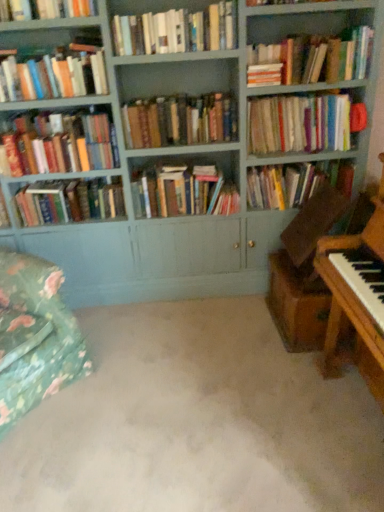
Identify the location of hardcover books at upper left, the tenth book positioned from the right. (x=54, y=74).

Where is `hardcover books at left, which is the 8th book in right-to-left order`? The width and height of the screenshot is (384, 512). hardcover books at left, which is the 8th book in right-to-left order is located at coordinates (60, 144).

This screenshot has width=384, height=512. Describe the element at coordinates (176, 31) in the screenshot. I see `hardcover books at upper center, marked as the 6th book in a right-to-left arrangement` at that location.

Describe the element at coordinates (183, 159) in the screenshot. The width and height of the screenshot is (384, 512). I see `wooden bookcase at upper center` at that location.

The image size is (384, 512). I want to click on carpet at center, so click(197, 421).

How many degrees apart are the facing directions of hardcover books at upper center, marked as the 6th book in a right-to-left arrangement, and hardcover books at upper left, the tenth book positioned from the right?

2.7 degrees.

Based on the photo, is hardcover books at upper center, marked as the 6th book in a right-to-left arrangement, taller or shorter than hardcover books at upper left, the tenth book positioned from the right?

Clearly, hardcover books at upper center, marked as the 6th book in a right-to-left arrangement, is shorter compared to hardcover books at upper left, the tenth book positioned from the right.

Between hardcover books at upper center, marked as the 6th book in a right-to-left arrangement, and hardcover books at upper left, arranged as the first book when viewed from the left, which one appears on the left side from the viewer's perspective?

From the viewer's perspective, hardcover books at upper left, arranged as the first book when viewed from the left, appears more on the left side.

Which point is more distant from viewer, [223,27] or [53,87]?

The point [53,87] is behind.

Is hardcover books at upper right, marked as the eighth book in a left-to-right arrangement, facing towards hardcover books at left, the third book viewed from the left?

No.

Considering the positions of objects hardcover books at upper right, marked as the eighth book in a left-to-right arrangement, and hardcover books at left, the third book viewed from the left, in the image provided, who is in front, hardcover books at upper right, marked as the eighth book in a left-to-right arrangement, or hardcover books at left, the third book viewed from the left,?

hardcover books at left, the third book viewed from the left, is in front.

Which is correct: hardcover books at upper right, marked as the eighth book in a left-to-right arrangement, is inside hardcover books at left, which is the 8th book in right-to-left order, or outside of it?

hardcover books at upper right, marked as the eighth book in a left-to-right arrangement, lies outside hardcover books at left, which is the 8th book in right-to-left order.

From a real-world perspective, is matte hardcover book at left, the 7th book positioned from the right, physically above hardcover book at upper left, arranged as the 2th book when viewed from the left?

No.

Which object is further away from the camera, matte hardcover book at left, the 7th book positioned from the right, or hardcover book at upper left, arranged as the 2th book when viewed from the left?

matte hardcover book at left, the 7th book positioned from the right, is further from the camera.

Consider the image. Does matte hardcover book at left, the 4th book positioned from the left, appear on the left side of hardcover book at upper left, arranged as the 2th book when viewed from the left?

In fact, matte hardcover book at left, the 4th book positioned from the left, is to the right of hardcover book at upper left, arranged as the 2th book when viewed from the left.

Is matte hardcover book at left, the 7th book positioned from the right, looking in the opposite direction of hardcover book at upper left, arranged as the 2th book when viewed from the left?

No, matte hardcover book at left, the 7th book positioned from the right, is not facing away from hardcover book at upper left, arranged as the 2th book when viewed from the left.

Is wooden bookcase at upper center located within hardcover book at upper left, arranged as the 2th book when viewed from the left?

No, wooden bookcase at upper center is not a part of hardcover book at upper left, arranged as the 2th book when viewed from the left.

Between hardcover book at upper left, arranged as the 2th book when viewed from the left, and wooden bookcase at upper center, which one has larger size?

wooden bookcase at upper center.

Considering the sizes of hardcover book at upper left, acting as the 9th book starting from the right, and wooden bookcase at upper center in the image, is hardcover book at upper left, acting as the 9th book starting from the right, taller or shorter than wooden bookcase at upper center?

Considering their sizes, hardcover book at upper left, acting as the 9th book starting from the right, has less height than wooden bookcase at upper center.

Considering the positions of objects hardcover book at upper left, arranged as the 2th book when viewed from the left, and wooden bookcase at upper center in the image provided, who is behind, hardcover book at upper left, arranged as the 2th book when viewed from the left, or wooden bookcase at upper center?

hardcover book at upper left, arranged as the 2th book when viewed from the left, is further away from the camera.

From a real-world perspective, is hardcover books at upper right, which is the ninth book from left to right, physically located above or below hardcover books at left, which is the 8th book in right-to-left order?

hardcover books at upper right, which is the ninth book from left to right, is situated higher than hardcover books at left, which is the 8th book in right-to-left order, in the real world.

Does hardcover books at upper right, which is the second book from right to left, appear on the left side of hardcover books at left, which is the 8th book in right-to-left order?

Incorrect, hardcover books at upper right, which is the second book from right to left, is not on the left side of hardcover books at left, which is the 8th book in right-to-left order.

Is hardcover books at upper right, which is the ninth book from left to right, facing towards hardcover books at left, which is the 8th book in right-to-left order?

No, hardcover books at upper right, which is the ninth book from left to right, is not oriented towards hardcover books at left, which is the 8th book in right-to-left order.

From the picture: Between hardcover books at upper right, which is the ninth book from left to right, and hardcover books at left, which is the 8th book in right-to-left order, which one has larger size?

hardcover books at upper right, which is the ninth book from left to right, is bigger.

Does point (261, 112) come in front of point (170, 106)?

No, it is not.

Can you confirm if hardcover books at upper right, marked as the eighth book in a left-to-right arrangement, is positioned to the right of hardcover books at center, positioned as the fifth book in right-to-left order?

Correct, you'll find hardcover books at upper right, marked as the eighth book in a left-to-right arrangement, to the right of hardcover books at center, positioned as the fifth book in right-to-left order.

Measure the distance from hardcover books at upper right, the 3th book viewed from the right, to hardcover books at center, the 6th book when ordered from left to right.

hardcover books at upper right, the 3th book viewed from the right, is 15.62 inches from hardcover books at center, the 6th book when ordered from left to right.

Where is `book that is the 8th object located behind the green floral fabric swivel chair at lower left`? Image resolution: width=384 pixels, height=512 pixels. book that is the 8th object located behind the green floral fabric swivel chair at lower left is located at coordinates (183, 192).

Can you confirm if green floral fabric swivel chair at lower left is positioned to the left of hardcover books at center, the fourth book when ordered from right to left?

Correct, you'll find green floral fabric swivel chair at lower left to the left of hardcover books at center, the fourth book when ordered from right to left.

In terms of size, does green floral fabric swivel chair at lower left appear bigger or smaller than hardcover books at center, the fourth book when ordered from right to left?

green floral fabric swivel chair at lower left is bigger than hardcover books at center, the fourth book when ordered from right to left.

The width and height of the screenshot is (384, 512). Identify the location of the 4th book counting from the left of the hardcover books at upper center, marked as the 6th book in a right-to-left arrangement. (x=54, y=74).

At what (x,y) coordinates should I click in order to perform the action: click on the 5th book to the right of the hardcover books at left, the third book viewed from the left, counting from the anchor's position. Please return your answer as a coordinate pair (x, y). This screenshot has height=512, width=384. Looking at the image, I should click on (300, 124).

When comparing their distances from hardcover books at upper right, which is the second book from right to left, does hardcover books at center, the fourth book when ordered from right to left, or hardcover book at center, which is the 1th book from right to left, seem further?

hardcover books at center, the fourth book when ordered from right to left, is positioned further to the anchor hardcover books at upper right, which is the second book from right to left.

Looking at the image, which one is located further to wooden bookcase at upper center, hardcover books at upper right, which is the ninth book from left to right, or wooden piano at right?

wooden piano at right.

Based on their spatial positions, is hardcover books at upper center, marked as the 6th book in a right-to-left arrangement, or wooden bookcase at upper center further from hardcover book at upper left, arranged as the 2th book when viewed from the left?

wooden bookcase at upper center is further to hardcover book at upper left, arranged as the 2th book when viewed from the left.

Which object lies nearer to the anchor point matte hardcover book at left, the 4th book positioned from the left, hardcover books at upper center, marked as the 6th book in a right-to-left arrangement, or wooden bookcase at upper center?

wooden bookcase at upper center is positioned closer to the anchor matte hardcover book at left, the 4th book positioned from the left.

From the image, which object appears to be nearer to hardcover books at upper center, arranged as the fifth book when viewed from the left, hardcover books at upper right, which is the ninth book from left to right, or hardcover books at upper right, marked as the eighth book in a left-to-right arrangement?

Based on the image, hardcover books at upper right, which is the ninth book from left to right, appears to be nearer to hardcover books at upper center, arranged as the fifth book when viewed from the left.

From the picture: When comparing their distances from hardcover books at upper left, the tenth book positioned from the right, does hardcover books at center, the 7th book when ordered from left to right, or hardcover books at upper right, the 3th book viewed from the right, seem further?

Based on the image, hardcover books at upper right, the 3th book viewed from the right, appears to be further to hardcover books at upper left, the tenth book positioned from the right.

Looking at the image, which one is located further to matte hardcover book at left, the 4th book positioned from the left, hardcover books at upper right, which is the second book from right to left, or hardcover books at center, the fourth book when ordered from right to left?

Based on the image, hardcover books at upper right, which is the second book from right to left, appears to be further to matte hardcover book at left, the 4th book positioned from the left.

Estimate the real-world distances between objects in this image. Which object is closer to hardcover books at upper right, marked as the eighth book in a left-to-right arrangement, hardcover books at upper left, arranged as the first book when viewed from the left, or wooden bookcase at upper center?

Among the two, wooden bookcase at upper center is located nearer to hardcover books at upper right, marked as the eighth book in a left-to-right arrangement.

Locate an element on the screen. This screenshot has height=512, width=384. bookcase located between matte hardcover book at left, the 7th book positioned from the right, and hardcover books at upper right, which is the ninth book from left to right, in the left-right direction is located at coordinates (183, 159).

You are a GUI agent. You are given a task and a screenshot of the screen. Output one action in this format:
    pyautogui.click(x=<x>, y=<y>)
    Task: Click on the plain between wooden piano at right and matte hardcover book at left, the 7th book positioned from the right, from front to back
    This screenshot has height=512, width=384.
    Given the screenshot: What is the action you would take?
    pyautogui.click(x=197, y=421)

Locate an element on the screen. bookcase between hardcover books at upper left, arranged as the first book when viewed from the left, and hardcover book at center, marked as the 10th book in a left-to-right arrangement, from left to right is located at coordinates (183, 159).

The height and width of the screenshot is (512, 384). I want to click on bookcase that lies between hardcover book at upper left, acting as the 9th book starting from the right, and matte hardcover book at left, the 4th book positioned from the left, from top to bottom, so click(x=183, y=159).